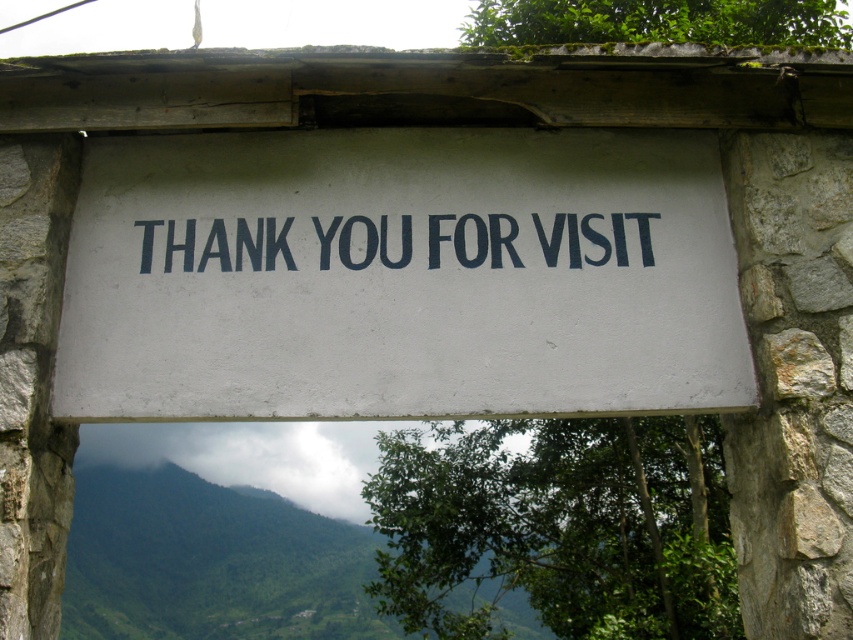
Can you confirm if white matte sign at center is taller than blackmaterial/texture sign at center?

Yes.

Who is lower down, white matte sign at center or blackmaterial/texture sign at center?

Positioned lower is white matte sign at center.

Describe the element at coordinates (399, 276) in the screenshot. I see `white matte sign at center` at that location.

Where is `white matte sign at center`? Image resolution: width=853 pixels, height=640 pixels. white matte sign at center is located at coordinates (399, 276).